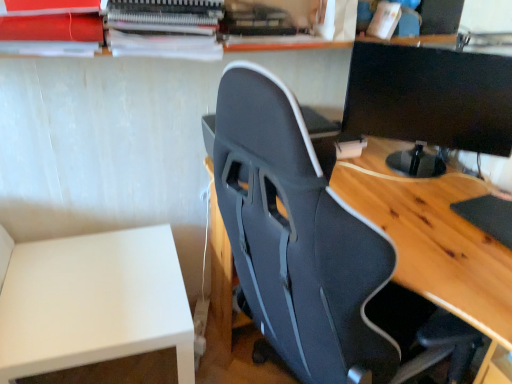
Question: In the image, is black glossy monitor at upper right on the left side or the right side of black fabric chair at center?

Choices:
 (A) left
 (B) right

Answer: (B)

Question: From the image's perspective, relative to black fabric chair at center, is black glossy monitor at upper right above or below?

Choices:
 (A) below
 (B) above

Answer: (B)

Question: Estimate the real-world distances between objects in this image. Which object is farther from the white matte table at lower left?

Choices:
 (A) black glossy monitor at upper right
 (B) black fabric chair at center

Answer: (A)

Question: Which of these objects is positioned closest to the black glossy monitor at upper right?

Choices:
 (A) black fabric chair at center
 (B) white matte table at lower left

Answer: (A)